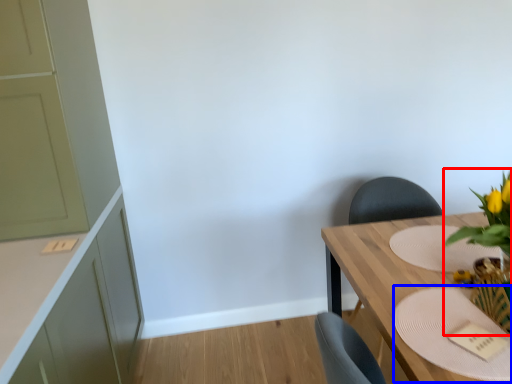
Question: Which of the following is the farthest to the observer, floral arrangement (highlighted by a red box) or plate (highlighted by a blue box)?

Choices:
 (A) floral arrangement
 (B) plate

Answer: (B)